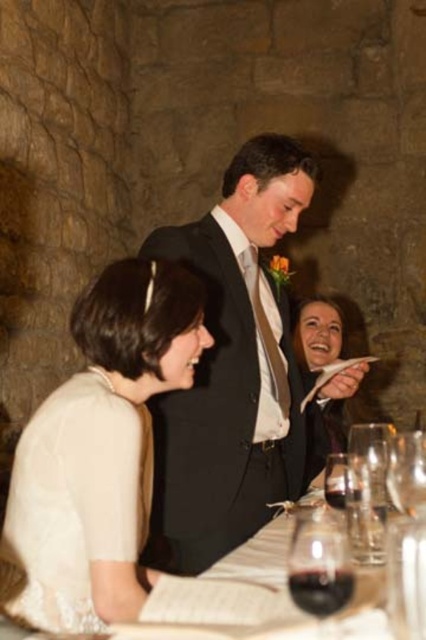
Is smooth beige dress at lower center shorter than translucent glass wine at center?

No.

Which is below, smooth beige dress at lower center or translucent glass wine at center?

translucent glass wine at center

Describe the element at coordinates (328, 419) in the screenshot. I see `smooth beige dress at lower center` at that location.

Identify the location of smooth beige dress at lower center. Image resolution: width=426 pixels, height=640 pixels. (328, 419).

Who is higher up, dark red glass at table center or translucent glass wine at center?

translucent glass wine at center is above.

Between point (310, 600) and point (354, 497), which one is positioned in front?

Point (310, 600)

The image size is (426, 640). Find the location of `dark red glass at table center`. dark red glass at table center is located at coordinates (321, 589).

What do you see at coordinates (328, 419) in the screenshot?
I see `smooth beige dress at lower center` at bounding box center [328, 419].

Is point (314, 470) farther from viewer compared to point (350, 589)?

Yes.

Is point (325, 436) farther from viewer compared to point (307, 570)?

Yes, point (325, 436) is behind point (307, 570).

Find the location of `smooth beige dress at lower center`. smooth beige dress at lower center is located at coordinates (328, 419).